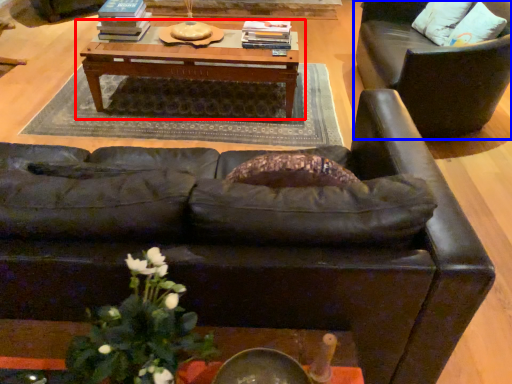
Question: Which of the following is the farthest to the observer, table (highlighted by a red box) or chair (highlighted by a blue box)?

Choices:
 (A) table
 (B) chair

Answer: (A)